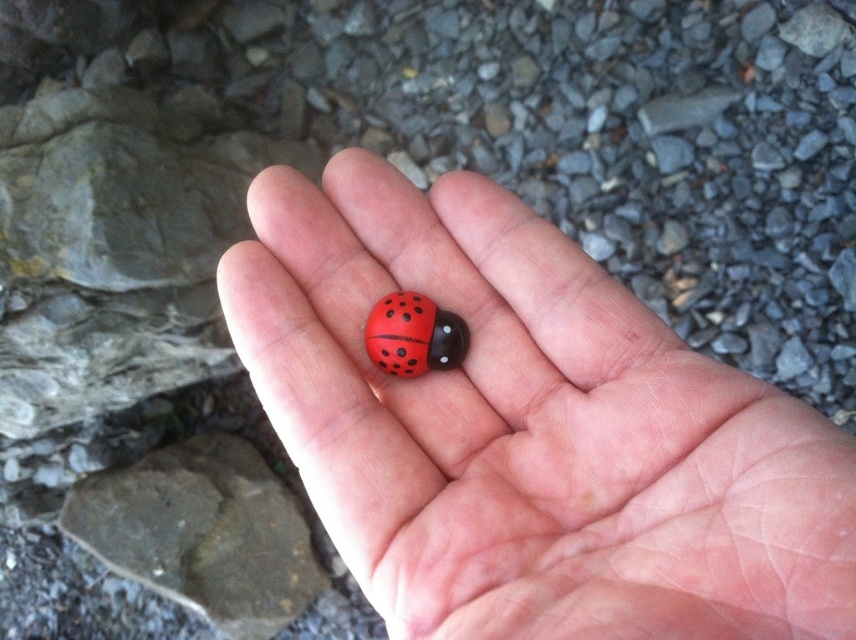
Question: Is matte plastic ladybug at center positioned in front of matte plastic ladybird at center?

Choices:
 (A) no
 (B) yes

Answer: (B)

Question: Can you confirm if smooth gray rock at lower left is wider than matte plastic ladybird at center?

Choices:
 (A) no
 (B) yes

Answer: (B)

Question: Is matte plastic ladybug at center further to camera compared to matte plastic ladybird at center?

Choices:
 (A) yes
 (B) no

Answer: (B)

Question: Which object is farther from the camera taking this photo?

Choices:
 (A) matte plastic ladybird at center
 (B) smooth gray rock at lower left

Answer: (B)

Question: Estimate the real-world distances between objects in this image. Which object is farther from the smooth gray rock at lower left?

Choices:
 (A) matte plastic ladybird at center
 (B) matte plastic ladybug at center

Answer: (B)

Question: Which of the following is the closest to the observer?

Choices:
 (A) (138, 529)
 (B) (801, 531)

Answer: (B)